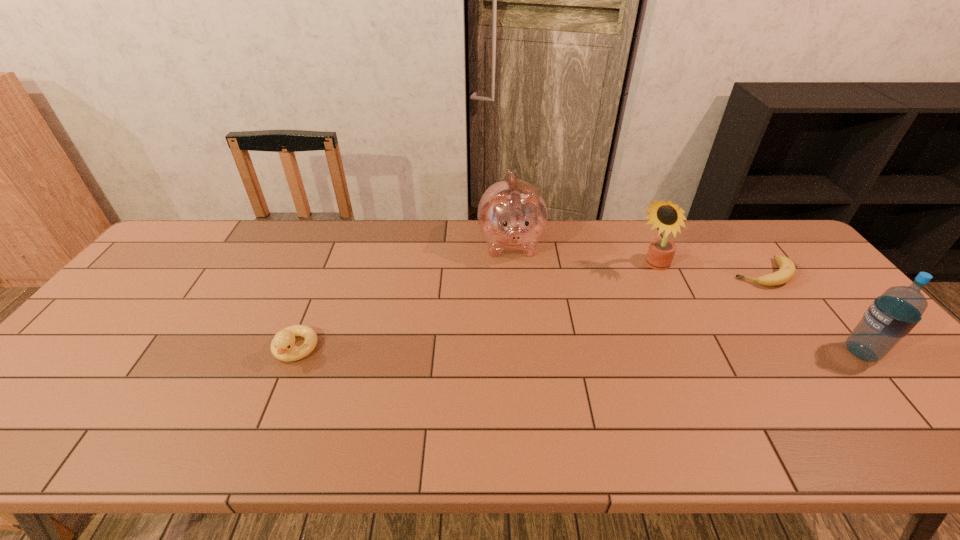
The height and width of the screenshot is (540, 960). In order to click on vacant region located on the face of the sunflower in this screenshot , I will do `click(605, 314)`.

Identify the location of vacant space located at the stem of the banana. Image resolution: width=960 pixels, height=540 pixels. (663, 330).

Image resolution: width=960 pixels, height=540 pixels. Identify the location of vacant space located at the stem of the banana. (695, 310).

Image resolution: width=960 pixels, height=540 pixels. I want to click on free region located 0.170m at the stem of the banana, so click(x=707, y=304).

The height and width of the screenshot is (540, 960). I want to click on free space located 0.240m on the front facing side of the second object from left to right, so click(522, 328).

Identify the location of vacant space located 0.140m on the front facing side of the second object from left to right. The image size is (960, 540). (518, 302).

At what (x,y) coordinates should I click in order to perform the action: click on blank space located on the front facing side of the second object from left to right. Please return your answer as a coordinate pair (x, y). Looking at the image, I should click on (522, 328).

This screenshot has width=960, height=540. I want to click on sunflower present at the far edge, so click(667, 216).

Find the location of a particular element. Image resolution: width=960 pixels, height=540 pixels. banana that is at the far edge is located at coordinates (786, 272).

Find the location of `piggy bank present at the far edge`. piggy bank present at the far edge is located at coordinates (512, 215).